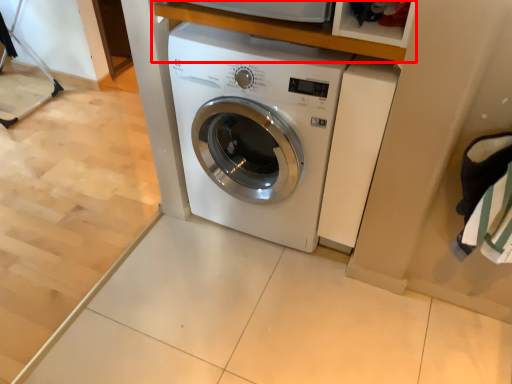
Question: From the image's perspective, what is the correct spatial relationship of shelf (annotated by the red box) in relation to washing machine?

Choices:
 (A) below
 (B) above

Answer: (B)